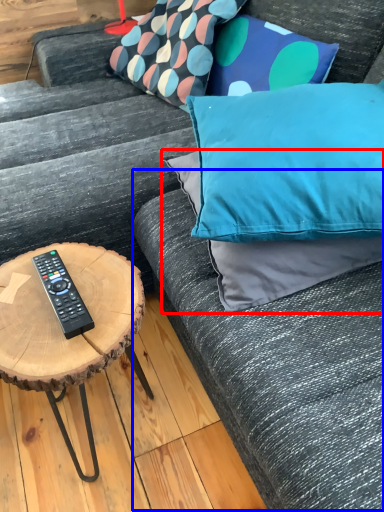
Question: Which object is further to the camera taking this photo, pillow (highlighted by a red box) or couch (highlighted by a blue box)?

Choices:
 (A) pillow
 (B) couch

Answer: (A)